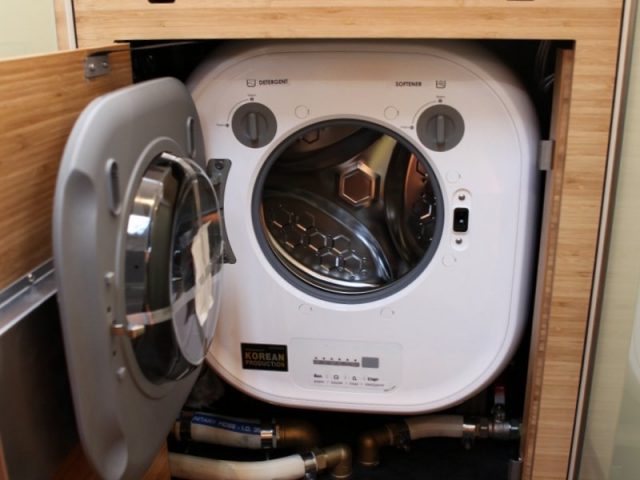
The height and width of the screenshot is (480, 640). What are the coordinates of `inside of washing machine silver in color` in the screenshot? It's located at (372, 214), (329, 247), (323, 162).